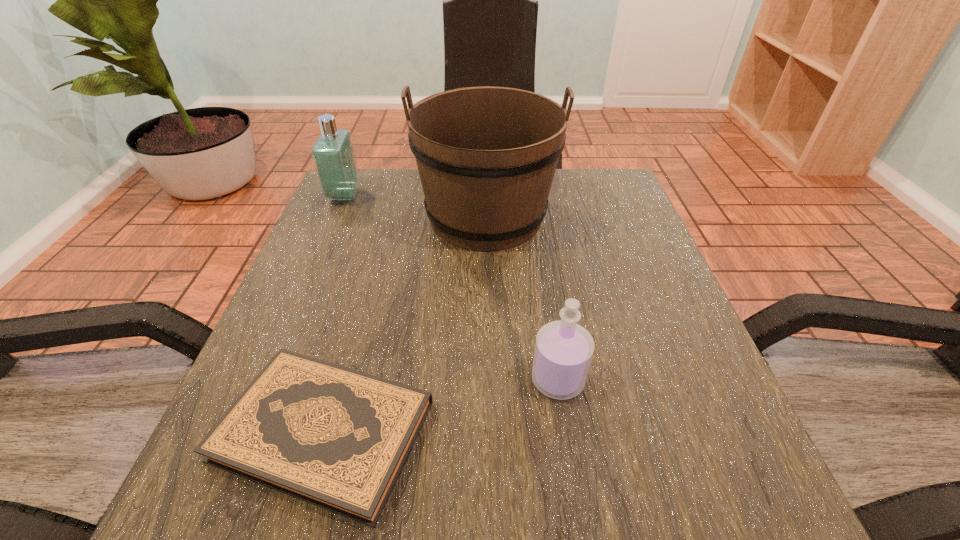
In order to click on perfume present at the far edge in this screenshot , I will do `click(333, 155)`.

The width and height of the screenshot is (960, 540). I want to click on object situated at the near edge, so click(x=338, y=438).

Where is `perfume present at the left edge`? The image size is (960, 540). perfume present at the left edge is located at coordinates (333, 155).

Locate an element on the screen. hardback book present at the left edge is located at coordinates (338, 438).

Locate an element on the screen. The width and height of the screenshot is (960, 540). object that is at the far left corner is located at coordinates (333, 155).

Locate an element on the screen. object located in the near left corner section of the desktop is located at coordinates (338, 438).

In the image, there is a desktop. Find the location of `vacant space at the near edge`. vacant space at the near edge is located at coordinates (580, 467).

Where is `vacant area at the left edge of the desktop`? Image resolution: width=960 pixels, height=540 pixels. vacant area at the left edge of the desktop is located at coordinates (327, 244).

Find the location of a particular element. This screenshot has width=960, height=540. free location at the right edge of the desktop is located at coordinates (636, 227).

The height and width of the screenshot is (540, 960). In the image, there is a desktop. In order to click on vacant space at the far left corner in this screenshot , I will do tap(391, 195).